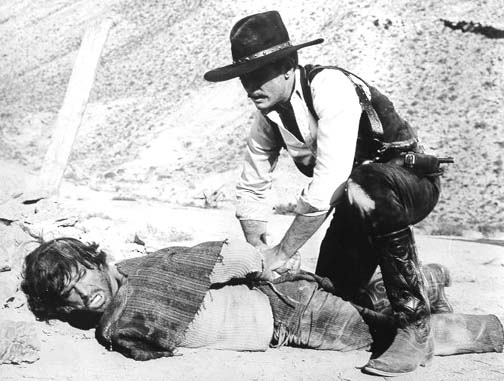
Image resolution: width=504 pixels, height=381 pixels. In order to click on board in this screenshot , I will do `click(69, 102)`.